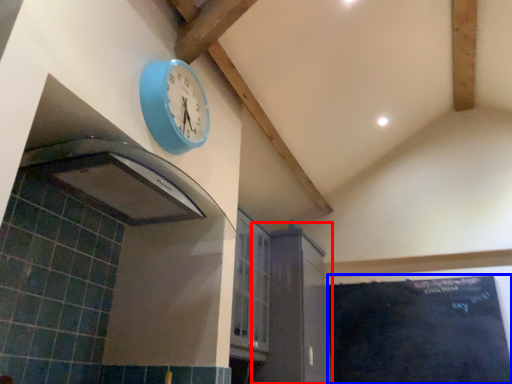
Question: Which point is further to the camera, cabinetry (highlighted by a red box) or bulletin board (highlighted by a blue box)?

Choices:
 (A) cabinetry
 (B) bulletin board

Answer: (B)